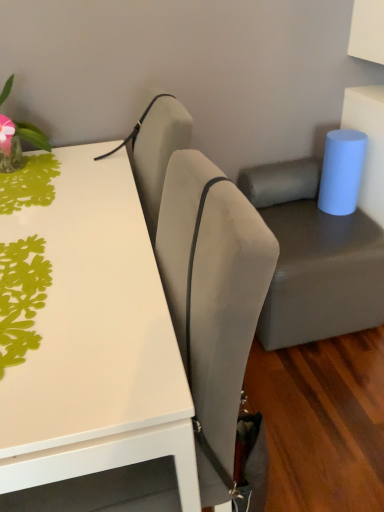
Locate an element on the screen. free space above matte gray swivel chair at center (from a real-world perspective) is located at coordinates (299, 217).